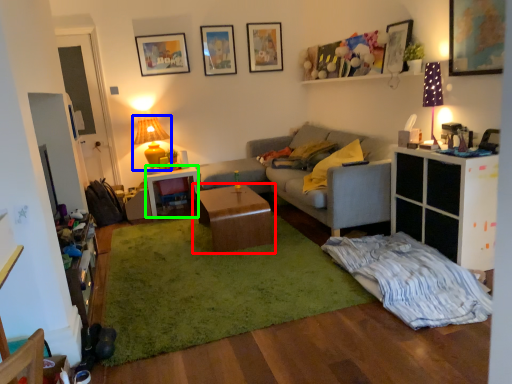
Question: Which is farther away from table (highlighted by a red box)? lamp (highlighted by a blue box) or desk (highlighted by a green box)?

Choices:
 (A) lamp
 (B) desk

Answer: (A)